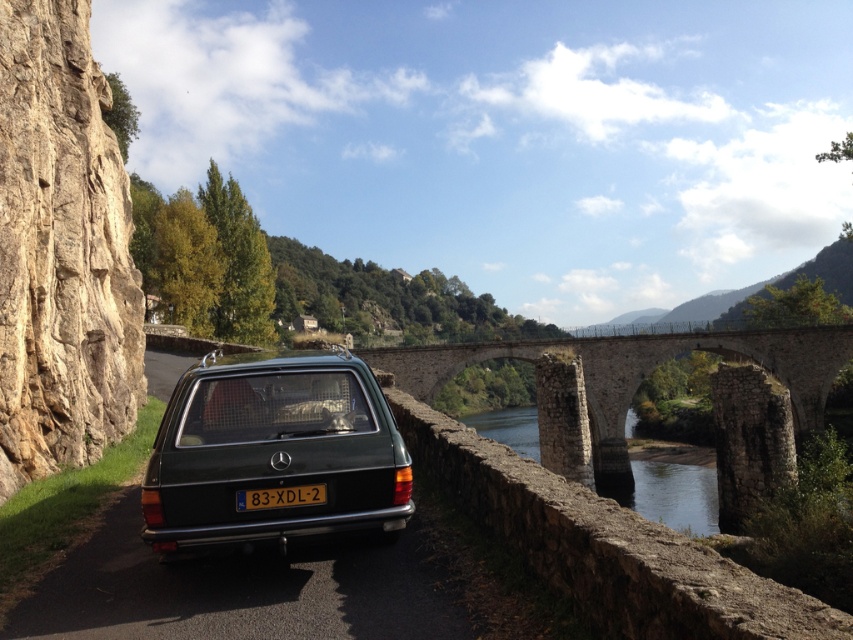
Can you confirm if stone arch bridge at center is positioned below clear stone water at center?

No.

Is stone arch bridge at center bigger than clear stone water at center?

Incorrect, stone arch bridge at center is not larger than clear stone water at center.

Locate an element on the screen. This screenshot has height=640, width=853. stone arch bridge at center is located at coordinates (637, 371).

Does metallic green station wagon at center appear under clear stone water at center?

No.

Which is behind, point (321, 532) or point (697, 483)?

The point (697, 483) is more distant.

Identify the location of metallic green station wagon at center. (273, 451).

Measure the distance between point (314, 412) and camera.

Point (314, 412) is 6.04 meters away from camera.

Can you confirm if metallic green station wagon at center is smaller than black plastic license plate at center?

No.

What do you see at coordinates (273, 451) in the screenshot?
I see `metallic green station wagon at center` at bounding box center [273, 451].

The image size is (853, 640). In order to click on metallic green station wagon at center in this screenshot , I will do `click(273, 451)`.